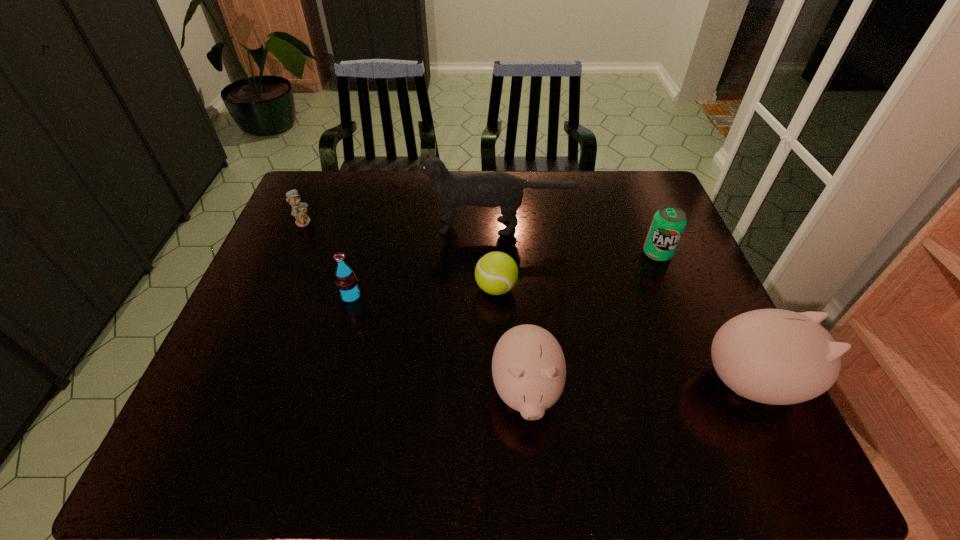
This screenshot has width=960, height=540. I want to click on the shorter piggy bank, so click(528, 366).

The height and width of the screenshot is (540, 960). I want to click on the second tallest object, so click(773, 356).

This screenshot has height=540, width=960. Find the location of `the taller piggy bank`. the taller piggy bank is located at coordinates (773, 356).

Where is `teddy bear`? teddy bear is located at coordinates (299, 210).

Locate an element on the screen. The image size is (960, 540). cat is located at coordinates (492, 189).

This screenshot has width=960, height=540. What are the coordinates of `the right soda` in the screenshot? It's located at (668, 224).

This screenshot has width=960, height=540. Find the location of `the farther soda`. the farther soda is located at coordinates (668, 224).

Where is `tennis ball`? The height and width of the screenshot is (540, 960). tennis ball is located at coordinates (496, 273).

Where is `the left soda`? Image resolution: width=960 pixels, height=540 pixels. the left soda is located at coordinates (347, 284).

You are a GUI agent. You are given a task and a screenshot of the screen. Output one action in this format:
    pyautogui.click(x=<x>, y=<y>)
    Task: Click on the sixth object from right to left
    The width and height of the screenshot is (960, 540).
    Given the screenshot: What is the action you would take?
    pyautogui.click(x=347, y=284)